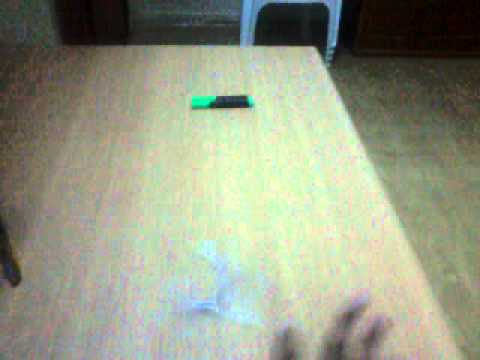
Identify the location of hardwood flooring. Image resolution: width=480 pixels, height=360 pixels. (450, 176).